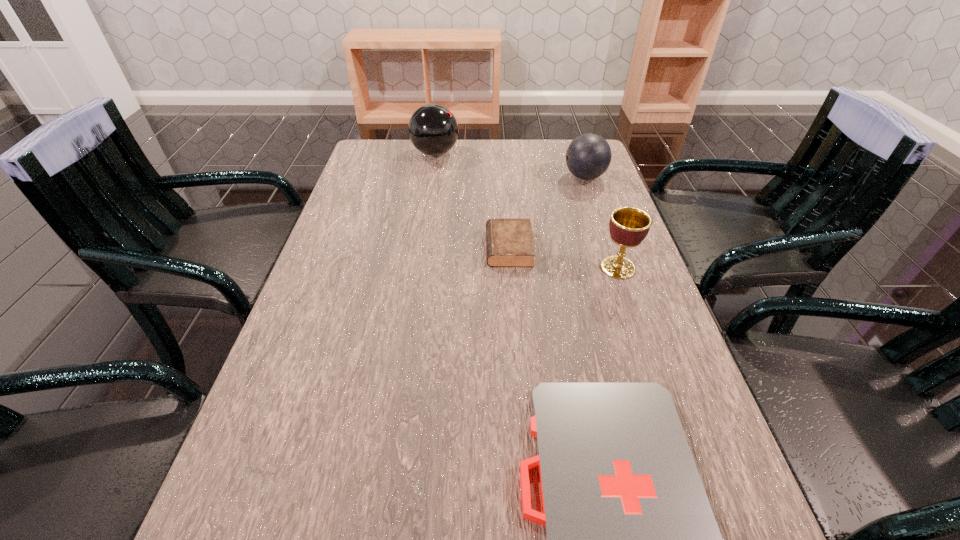
I want to click on vacant area at the left edge, so click(348, 228).

Locate an element on the screen. The height and width of the screenshot is (540, 960). vacant area at the right edge is located at coordinates (697, 443).

This screenshot has height=540, width=960. What are the coordinates of `vacant point at the far left corner` in the screenshot? It's located at (396, 162).

Locate an element on the screen. vacant space that is in between the taller bowling ball and the chalice is located at coordinates (526, 211).

Where is `free area in between the chalice and the second shortest object`? free area in between the chalice and the second shortest object is located at coordinates (564, 258).

The height and width of the screenshot is (540, 960). I want to click on free spot between the chalice and the diary, so click(x=564, y=258).

Find the location of a particular element. The image size is (960, 540). unoccupied area between the nearer bowling ball and the fourth tallest object is located at coordinates (547, 212).

Locate an element on the screen. The image size is (960, 540). vacant area between the farther bowling ball and the chalice is located at coordinates (526, 211).

Locate an element on the screen. This screenshot has width=960, height=540. object that can be found as the second closest to the farther bowling ball is located at coordinates (509, 242).

At what (x,y) coordinates should I click in order to perform the action: click on object identified as the fourth closest to the nearer bowling ball. Please return your answer as a coordinate pair (x, y). Image resolution: width=960 pixels, height=540 pixels. Looking at the image, I should click on (631, 539).